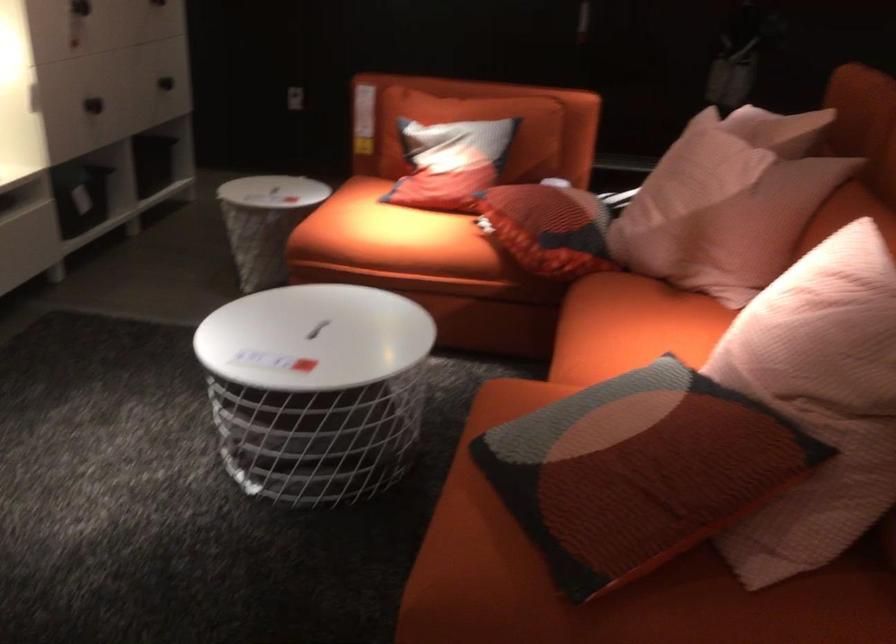
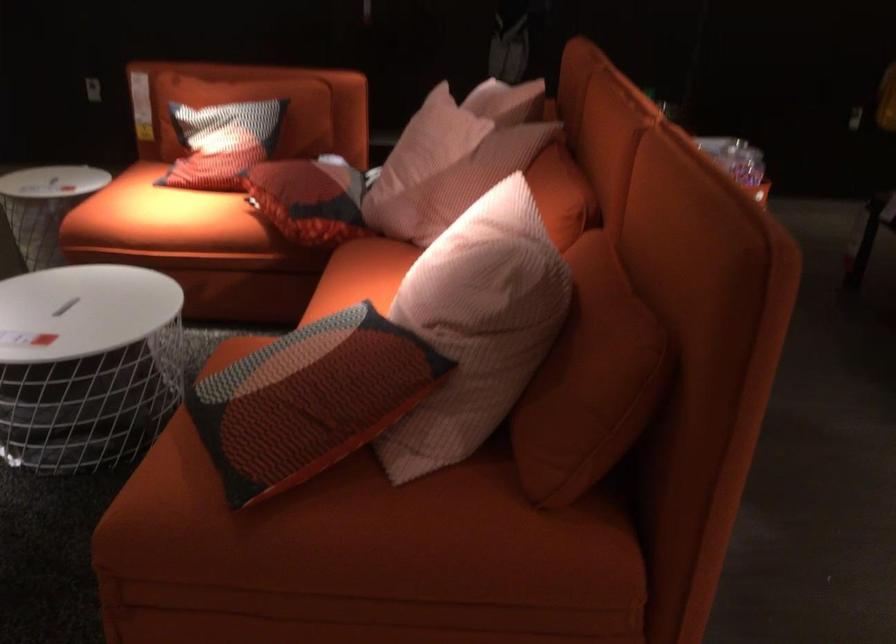
Locate, in the second image, the point that corresponds to [624,313] in the first image.

(360, 276)